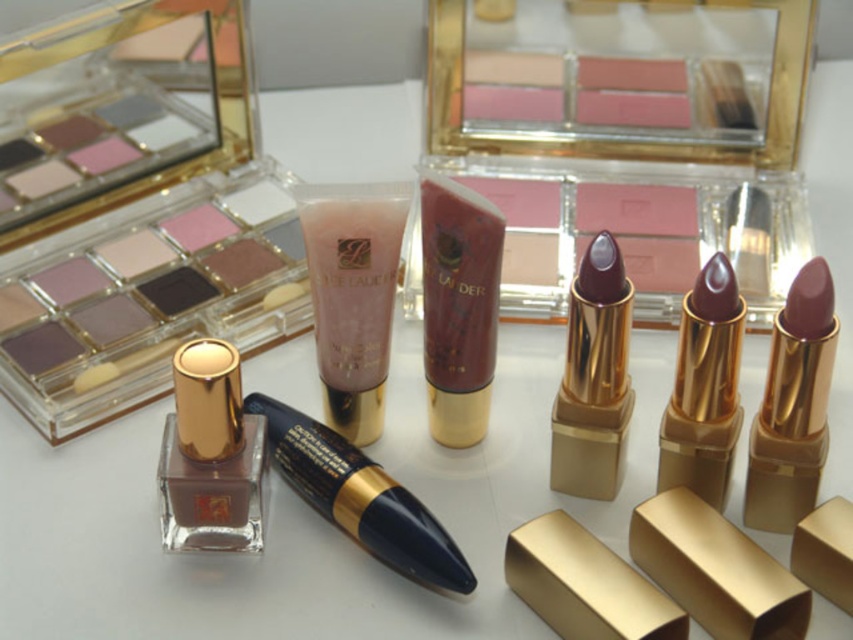
Is shiny purple lipstick at center above matte purple lipstick at center-right?

Yes, shiny purple lipstick at center is above matte purple lipstick at center-right.

Consider the image. Who is taller, shiny purple lipstick at center or matte purple lipstick at center-right?

Standing taller between the two is shiny purple lipstick at center.

Where is `shiny purple lipstick at center`? shiny purple lipstick at center is located at coordinates (593, 378).

Does matte pink cream at center have a greater height compared to matte pink tube at center?

In fact, matte pink cream at center may be shorter than matte pink tube at center.

Is point (370, 236) behind point (492, 294)?

No, it is in front of (492, 294).

Which is in front, point (387, 244) or point (463, 442)?

Point (387, 244)

Locate an element on the screen. This screenshot has height=640, width=853. matte pink cream at center is located at coordinates (352, 294).

Between matte pink cream at center and matte gold lipstick at right, which one is positioned higher?

matte pink cream at center is above.

Does matte pink cream at center have a greater width compared to matte gold lipstick at right?

Correct, the width of matte pink cream at center exceeds that of matte gold lipstick at right.

Does point (338, 330) come behind point (805, 476)?

That is True.

Identify the location of matte pink cream at center. The width and height of the screenshot is (853, 640). (352, 294).